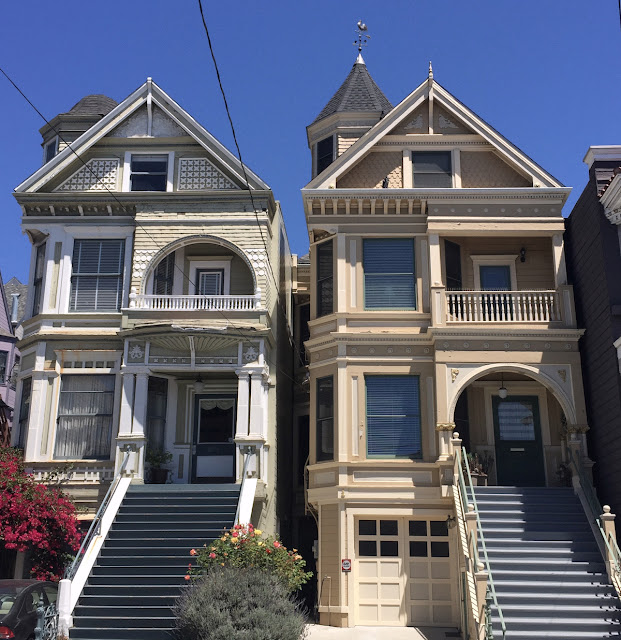
This screenshot has width=621, height=640. What are the coordinates of `entrance` in the screenshot? It's located at (394, 596).